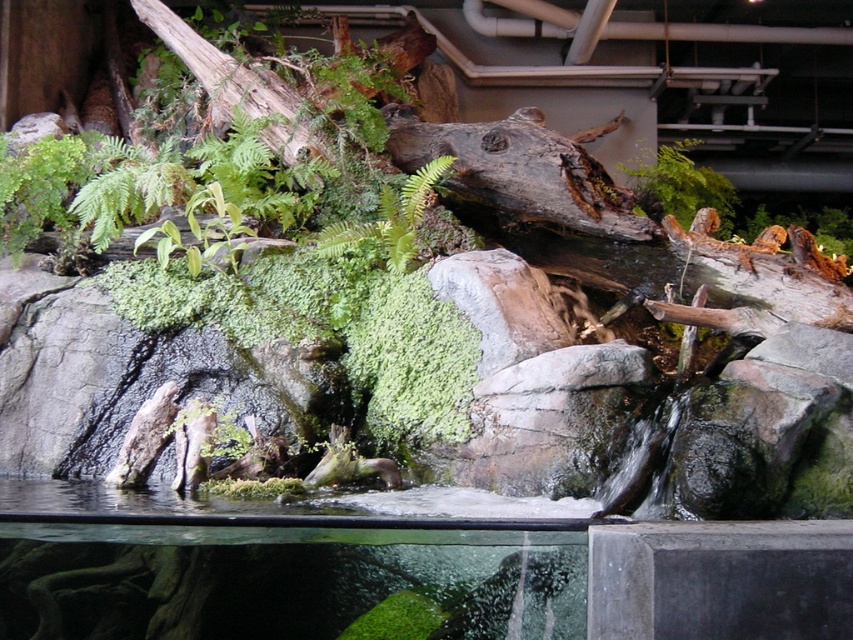
Who is taller, green mossy plant at upper center or green leafy plant at center?

Standing taller between the two is green mossy plant at upper center.

Does green mossy plant at upper center have a greater height compared to green leafy plant at center?

Indeed, green mossy plant at upper center has a greater height compared to green leafy plant at center.

Locate an element on the screen. Image resolution: width=853 pixels, height=640 pixels. green mossy plant at upper center is located at coordinates (680, 186).

Is green fuzzy fern at center closer to camera compared to green leafy plant at center?

No, it is not.

Can you confirm if green fuzzy fern at center is positioned above green leafy plant at center?

Yes, green fuzzy fern at center is above green leafy plant at center.

Find the location of a particular element. The width and height of the screenshot is (853, 640). green fuzzy fern at center is located at coordinates (392, 218).

Who is lower down, green fuzzy fern at upper left or green fuzzy fern at center?

Positioned lower is green fuzzy fern at center.

Is green fuzzy fern at upper left bigger than green fuzzy fern at center?

No.

Between point (4, 216) and point (392, 216), which one is positioned behind?

Positioned behind is point (4, 216).

The image size is (853, 640). Identify the location of green fuzzy fern at upper left. (39, 188).